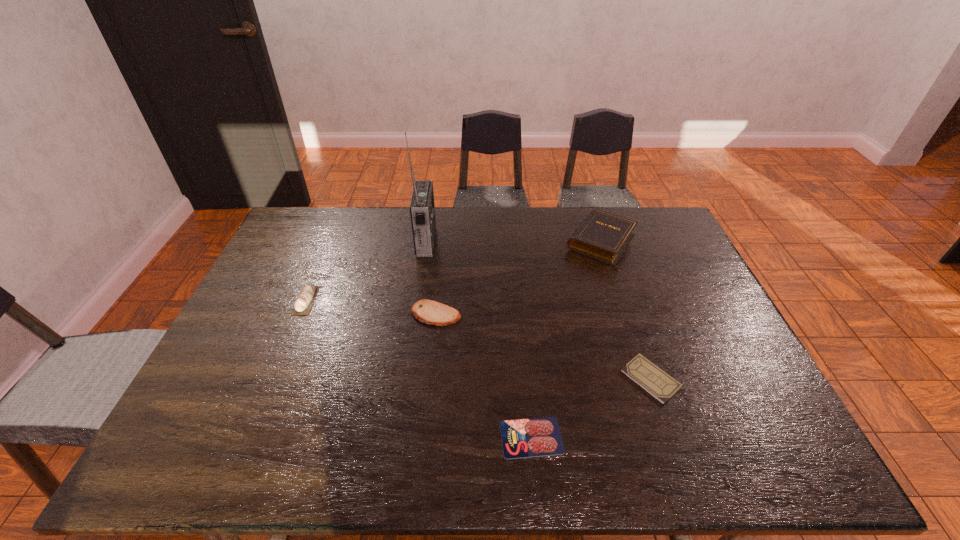
Find the location of `radio receiver`. radio receiver is located at coordinates (422, 208).

Where is `the fifth shortest object`? the fifth shortest object is located at coordinates (603, 236).

Image resolution: width=960 pixels, height=540 pixels. In order to click on the leftmost object in this screenshot , I will do `click(303, 304)`.

Locate an element on the screen. the taller pita bread is located at coordinates (303, 304).

Locate an element on the screen. the shorter pita bread is located at coordinates click(x=430, y=312).

Where is `the right pita bread`? the right pita bread is located at coordinates (430, 312).

Locate an element on the screen. The image size is (960, 540). checkbook is located at coordinates (660, 385).

Where is `the second nearest object`? The image size is (960, 540). the second nearest object is located at coordinates (660, 385).

Identify the location of the nearest object. (522, 438).

Locate an element on the screen. the fourth object from left to right is located at coordinates (522, 438).